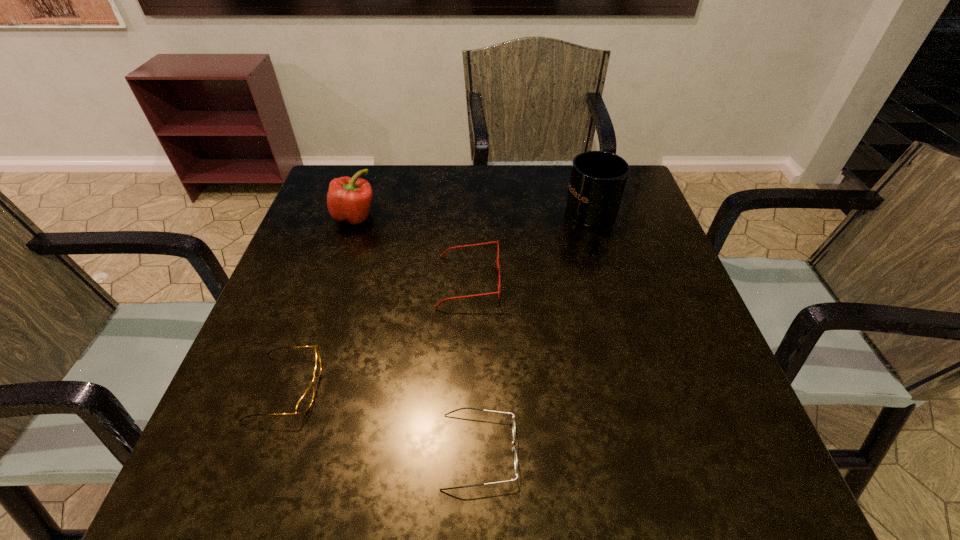
You are a GUI agent. You are given a task and a screenshot of the screen. Output one action in this format:
    pyautogui.click(x=<x>, y=<y>)
    Task: Click on the rightmost object
    
    Given the screenshot: What is the action you would take?
    pyautogui.click(x=598, y=178)

The height and width of the screenshot is (540, 960). In order to click on the tallest object in this screenshot , I will do `click(598, 178)`.

This screenshot has width=960, height=540. I want to click on bell pepper, so click(349, 199).

Image resolution: width=960 pixels, height=540 pixels. Find the location of `the tallest spectacles`. the tallest spectacles is located at coordinates (498, 269).

Where is `the third shortest object`? The image size is (960, 540). the third shortest object is located at coordinates (498, 269).

You are a GUI agent. You are given a task and a screenshot of the screen. Output one action in this format:
    pyautogui.click(x=<x>, y=<y>)
    Task: Click on the leftmost spectacles
    The width and height of the screenshot is (960, 540).
    Given the screenshot: What is the action you would take?
    tap(304, 403)

Where is `free space located with the handle on the side of the tallest object`? free space located with the handle on the side of the tallest object is located at coordinates (577, 168).

At what (x,y) coordinates should I click in order to perform the action: click on vacant space located 0.050m with the handle on the side of the tallest object. Please return your answer as a coordinate pair (x, y). Looking at the image, I should click on (581, 179).

At what (x,y) coordinates should I click in order to perform the action: click on free space located 0.050m on the front of the second tallest object. Please return your answer as a coordinate pair (x, y). This screenshot has height=540, width=960. Looking at the image, I should click on (347, 244).

This screenshot has width=960, height=540. Find the location of `vacant region located 0.220m on the face of the third shortest object`. vacant region located 0.220m on the face of the third shortest object is located at coordinates (599, 281).